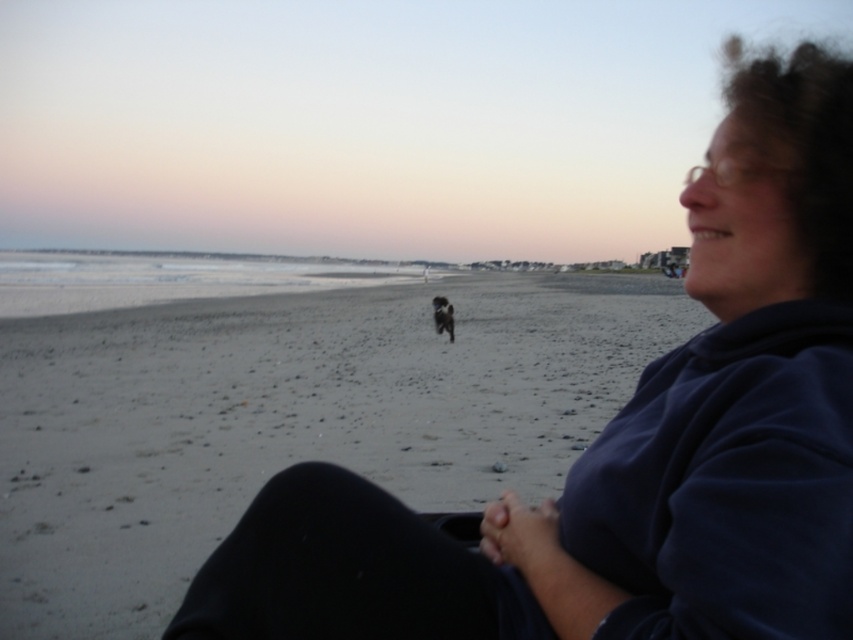
Can you confirm if gray sand at center is wider than black fur dog at center?

Indeed, gray sand at center has a greater width compared to black fur dog at center.

Is gray sand at center to the left of black fur dog at center from the viewer's perspective?

No, gray sand at center is not to the left of black fur dog at center.

Between point (274, 444) and point (432, 300), which one is positioned in front?

Point (274, 444) is in front.

Image resolution: width=853 pixels, height=640 pixels. Identify the location of gray sand at center. (289, 419).